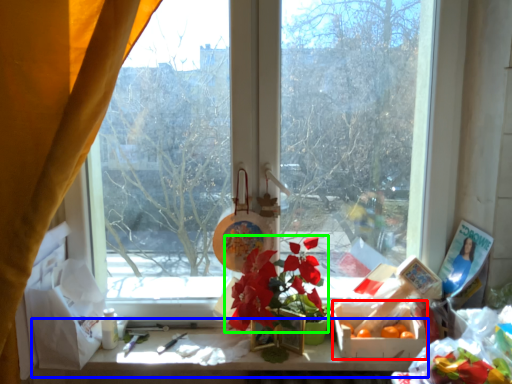
Question: Which object is the closest to the flower box (highlighted by a red box)? Choose among these: table (highlighted by a blue box) or flower (highlighted by a green box).

Choices:
 (A) table
 (B) flower

Answer: (A)